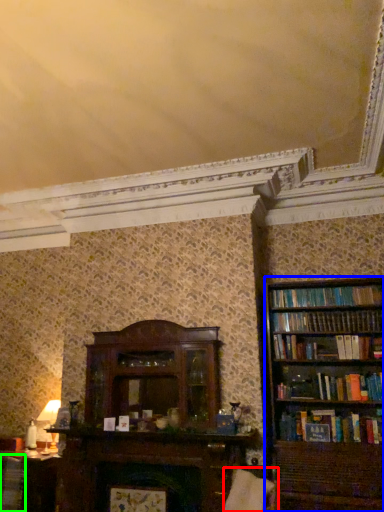
Question: Which object is positioned farthest from swivel chair (highlighted by a red box)? Select from bookcase (highlighted by a blue box) and book (highlighted by a green box).

Choices:
 (A) bookcase
 (B) book

Answer: (B)